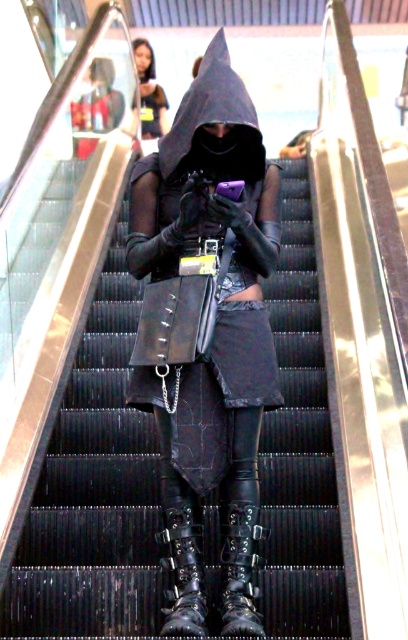
Identify the location of matte black hoodie at center. (212, 337).

Does matte black hoodie at center have a greater width compared to black leather boot at center?

Correct, the width of matte black hoodie at center exceeds that of black leather boot at center.

Locate an element on the screen. This screenshot has height=640, width=408. matte black hoodie at center is located at coordinates (212, 337).

Identify the location of matte black hoodie at center. (212, 337).

Between black leather bag at center and black leather boot at center, which one is positioned higher?

Positioned higher is black leather bag at center.

The height and width of the screenshot is (640, 408). What do you see at coordinates (93, 493) in the screenshot?
I see `black leather bag at center` at bounding box center [93, 493].

What are the coordinates of `black leather bag at center` in the screenshot? It's located at (93, 493).

Does matte black hoodie at center appear over leather/black boots at lower center?

Indeed, matte black hoodie at center is positioned over leather/black boots at lower center.

Is point (215, 481) farther from viewer compared to point (190, 593)?

That is True.

Locate an element on the screen. matte black hoodie at center is located at coordinates (212, 337).